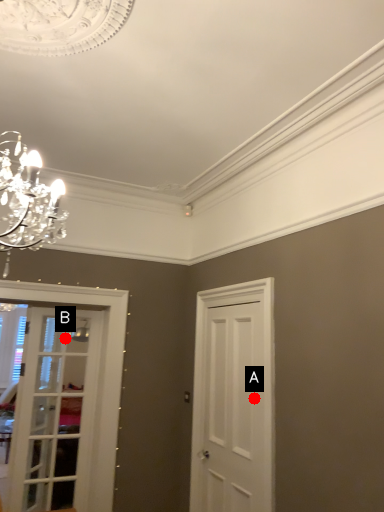
Question: Two points are circled on the image, labeled by A and B beside each circle. Which point is further to the camera?

Choices:
 (A) A is further
 (B) B is further

Answer: (B)